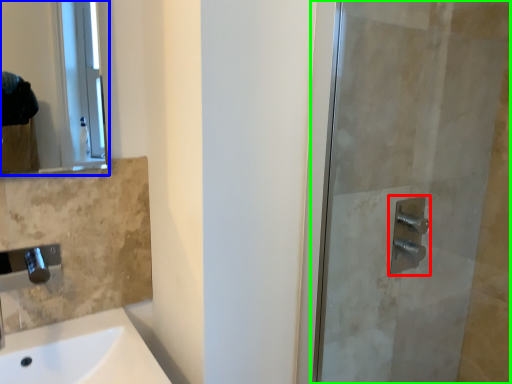
Question: Which is nearer to the shower (highlighted by a red box)? mirror (highlighted by a blue box) or screen door (highlighted by a green box).

Choices:
 (A) mirror
 (B) screen door

Answer: (B)